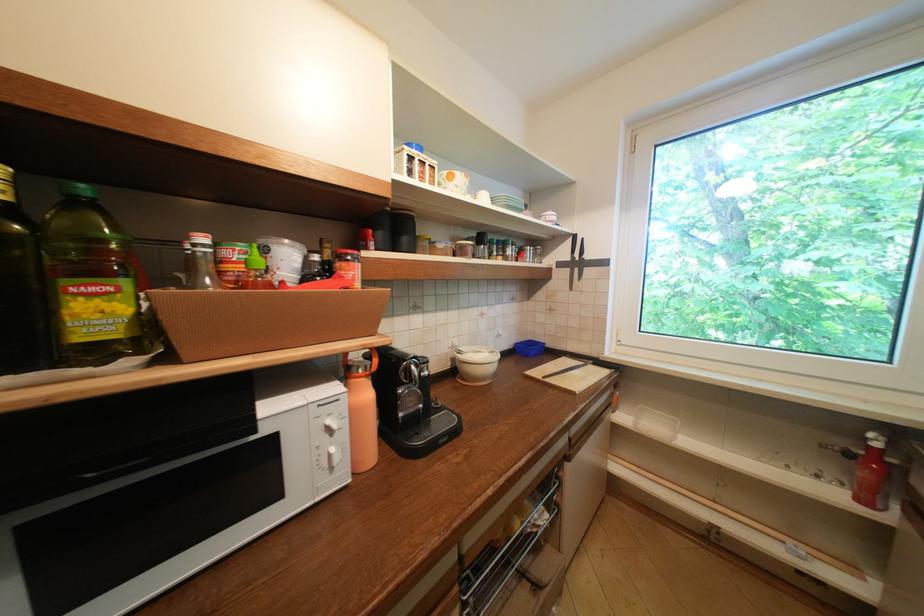
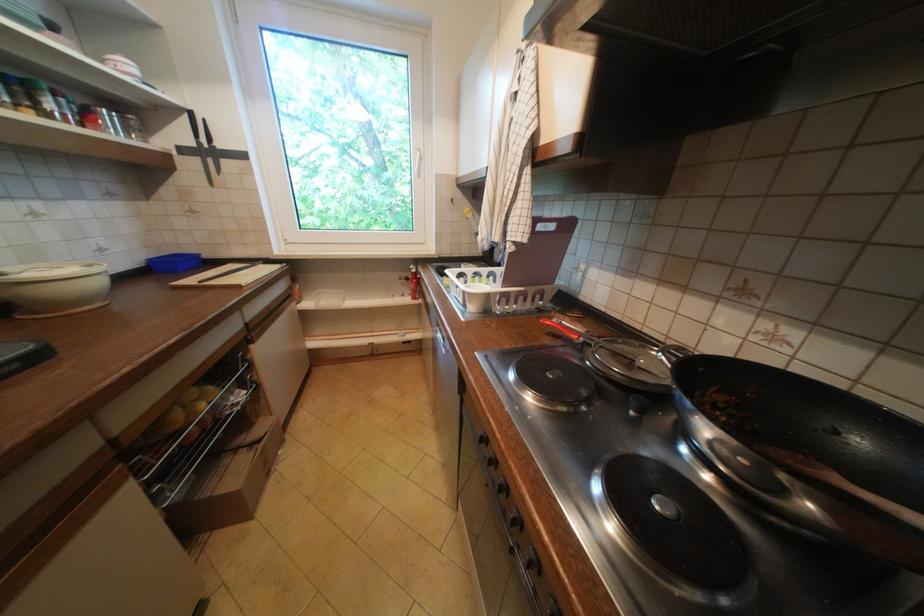
Locate, in the second image, the point that corresponds to (578,241) in the first image.

(195, 119)